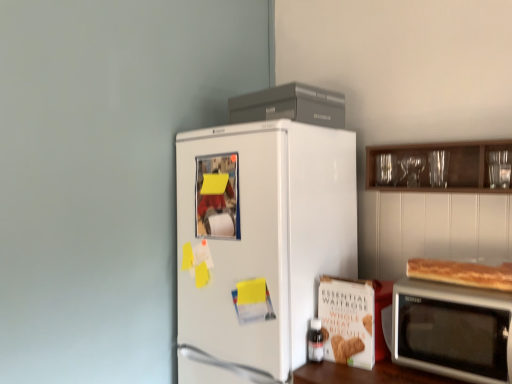
Question: From a real-world perspective, does matte glass bottle at lower center stand above white matte refrigerator at center?

Choices:
 (A) no
 (B) yes

Answer: (A)

Question: Is matte glass bottle at lower center taller than white matte refrigerator at center?

Choices:
 (A) yes
 (B) no

Answer: (B)

Question: Does matte glass bottle at lower center turn towards white matte refrigerator at center?

Choices:
 (A) yes
 (B) no

Answer: (B)

Question: Considering the relative sizes of matte glass bottle at lower center and white matte refrigerator at center in the image provided, is matte glass bottle at lower center shorter than white matte refrigerator at center?

Choices:
 (A) yes
 (B) no

Answer: (A)

Question: From the image's perspective, is matte glass bottle at lower center over white matte refrigerator at center?

Choices:
 (A) yes
 (B) no

Answer: (B)

Question: In terms of height, does satin silver microwave at lower right look taller or shorter compared to golden brown crusty bread at right?

Choices:
 (A) tall
 (B) short

Answer: (A)

Question: Considering the positions of satin silver microwave at lower right and golden brown crusty bread at right in the image, is satin silver microwave at lower right wider or thinner than golden brown crusty bread at right?

Choices:
 (A) wide
 (B) thin

Answer: (A)

Question: From the image's perspective, is satin silver microwave at lower right positioned above or below golden brown crusty bread at right?

Choices:
 (A) above
 (B) below

Answer: (B)

Question: Would you say satin silver microwave at lower right is inside or outside golden brown crusty bread at right?

Choices:
 (A) outside
 (B) inside

Answer: (A)

Question: In terms of height, does golden brown crusty bread at right look taller or shorter compared to satin silver microwave at lower right?

Choices:
 (A) short
 (B) tall

Answer: (A)

Question: Is golden brown crusty bread at right spatially inside satin silver microwave at lower right, or outside of it?

Choices:
 (A) inside
 (B) outside

Answer: (B)

Question: From the image's perspective, is golden brown crusty bread at right located above or below satin silver microwave at lower right?

Choices:
 (A) below
 (B) above

Answer: (B)

Question: In terms of width, does golden brown crusty bread at right look wider or thinner when compared to satin silver microwave at lower right?

Choices:
 (A) thin
 (B) wide

Answer: (A)

Question: In terms of height, does matte glass bottle at lower center look taller or shorter compared to golden brown crusty bread at right?

Choices:
 (A) tall
 (B) short

Answer: (A)

Question: From the image's perspective, is matte glass bottle at lower center located above or below golden brown crusty bread at right?

Choices:
 (A) below
 (B) above

Answer: (A)